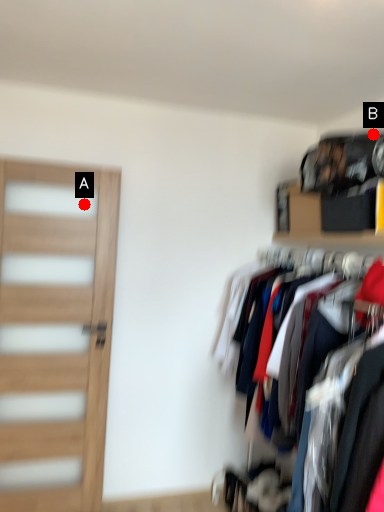
Question: Two points are circled on the image, labeled by A and B beside each circle. Which point is closer to the camera?

Choices:
 (A) A is closer
 (B) B is closer

Answer: (B)